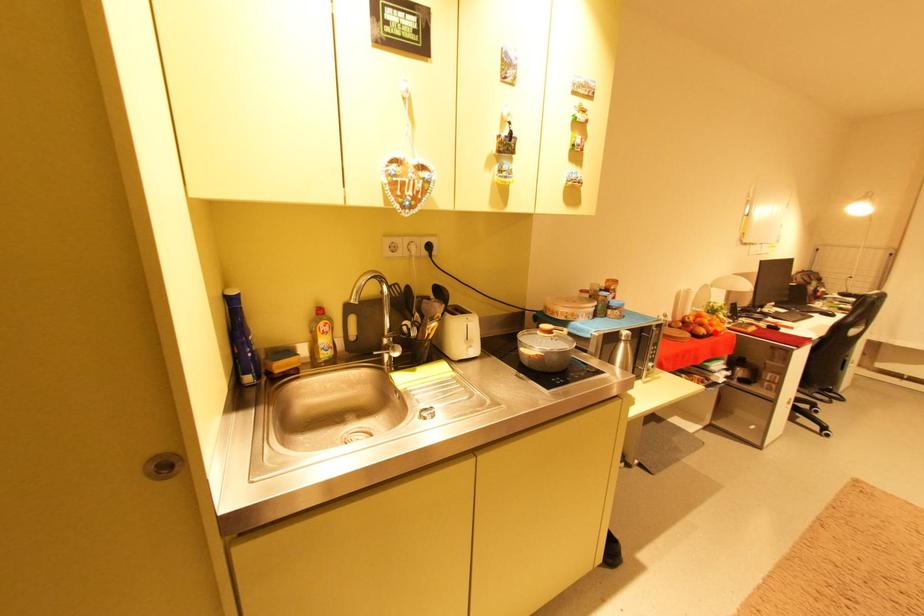
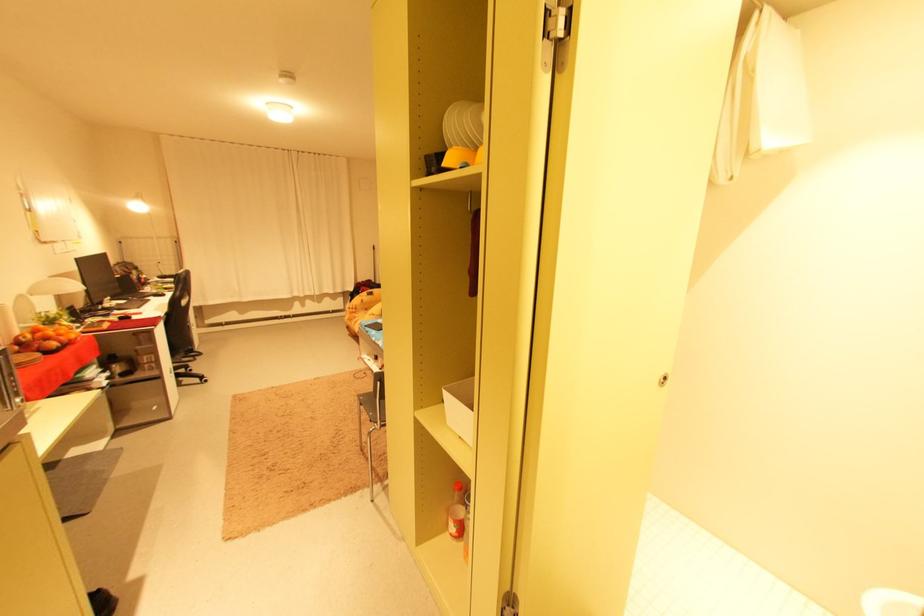
Question: I am providing you with two images of the same scene from different viewpoints. Given a red point in image1, look at the same physical point in image2. Is it:

Choices:
 (A) Closer to the viewpoint
 (B) Farther from the viewpoint

Answer: (B)